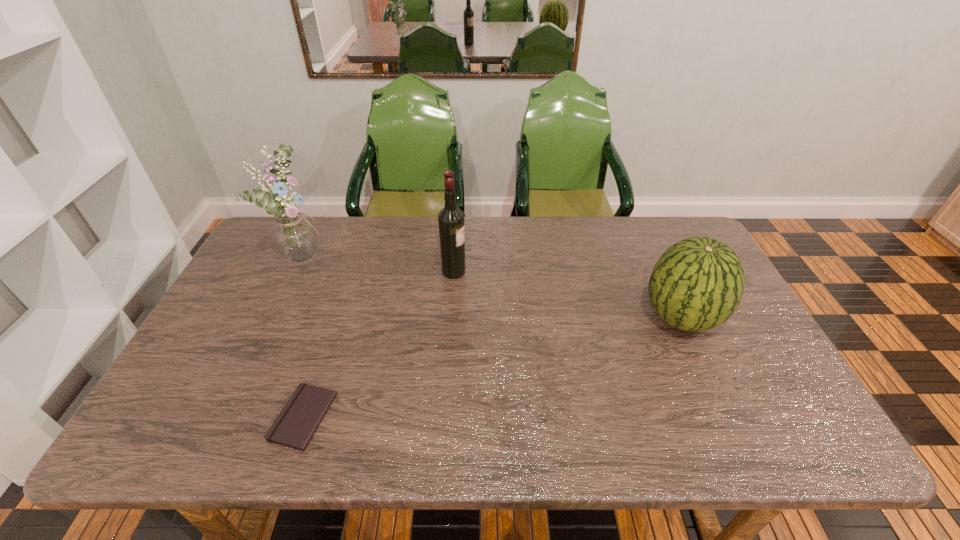
Point out which object is positioned as the third nearest to the rightmost object. Please provide its 2D coordinates. Your answer should be formatted as a tuple, i.e. [(x, y)], where the tuple contains the x and y coordinates of a point satisfying the conditions above.

[(294, 235)]

Locate an element on the screen. Image resolution: width=960 pixels, height=540 pixels. vacant space that satisfies the following two spatial constraints: 1. on the front and back of the wine bottle; 2. on the back side of the third farthest object is located at coordinates (451, 318).

This screenshot has height=540, width=960. What are the coordinates of `free space that satisfies the following two spatial constraints: 1. on the front-facing side of the bouquet; 2. on the left side of the third object from right to left` in the screenshot? It's located at (229, 417).

This screenshot has width=960, height=540. I want to click on vacant space that satisfies the following two spatial constraints: 1. on the front-facing side of the bouquet; 2. on the back side of the second object from left to right, so click(229, 417).

Find the location of a particular element. vacant region that satisfies the following two spatial constraints: 1. on the back side of the third tallest object; 2. on the front-facing side of the bouquet is located at coordinates (652, 254).